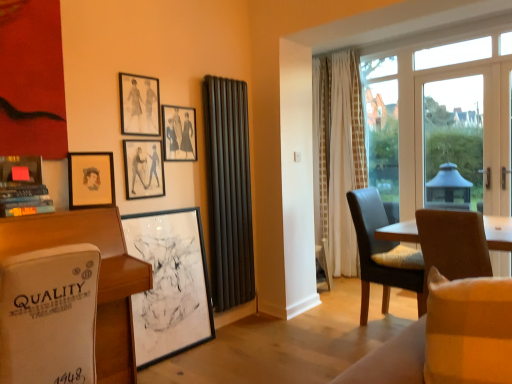
Question: From the image's perspective, is white glass door at right, the 2th window screen from the left, above or below matte black picture frame at upper left, marked as the 4th picture frame in a top-to-bottom arrangement?

Choices:
 (A) below
 (B) above

Answer: (B)

Question: Considering the positions of white glass door at right, the second window screen viewed from the back, and matte black picture frame at upper left, marked as the 4th picture frame in a top-to-bottom arrangement, in the image, is white glass door at right, the second window screen viewed from the back, bigger or smaller than matte black picture frame at upper left, marked as the 4th picture frame in a top-to-bottom arrangement,?

Choices:
 (A) big
 (B) small

Answer: (A)

Question: Which object is the farthest from the black matte picture frame at center, which is counted as the 5th picture frame, starting from the top?

Choices:
 (A) white glass door at right, placed as the 1th window screen when sorted from right to left
 (B) matte black radiator at center, arranged as the second curtain when viewed from the right
 (C) plush beige couch at lower right
 (D) matte black picture frame at upper left, acting as the second picture frame starting from the bottom
 (E) transparent glass window at center, acting as the first window screen starting from the left

Answer: (A)

Question: Which object is positioned closest to the matte black picture frame at upper left, acting as the second picture frame starting from the bottom?

Choices:
 (A) white leather desk at lower left
 (B) matte black picture frame at upper left, the 5th picture frame in the bottom-to-top sequence
 (C) white sheer curtain at center, which ranks as the 1th curtain in back-to-front order
 (D) matte black picture frame at upper center, the 4th picture frame in the bottom-to-top sequence
 (E) black matte picture frame at upper center, marked as the 3th picture frame in a bottom-to-top arrangement

Answer: (E)